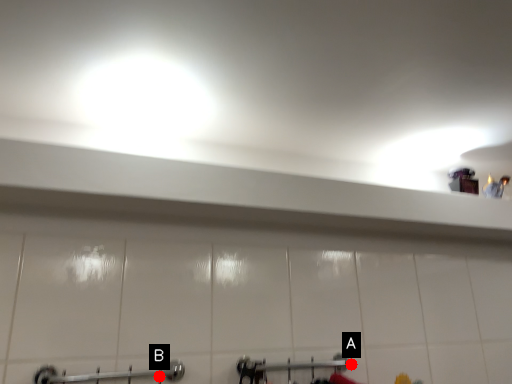
Question: Two points are circled on the image, labeled by A and B beside each circle. Which point is closer to the camera?

Choices:
 (A) A is closer
 (B) B is closer

Answer: (B)